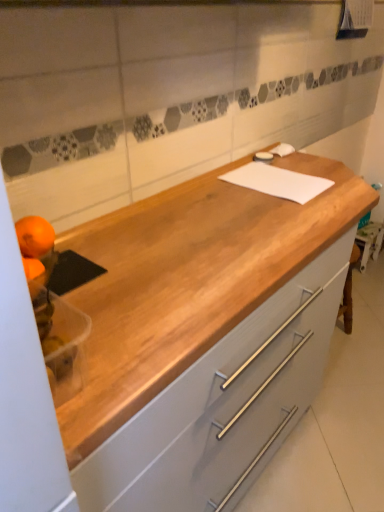
Image resolution: width=384 pixels, height=512 pixels. I want to click on vacant space situated above white matte cutting board at center (from a real-world perspective), so click(x=281, y=175).